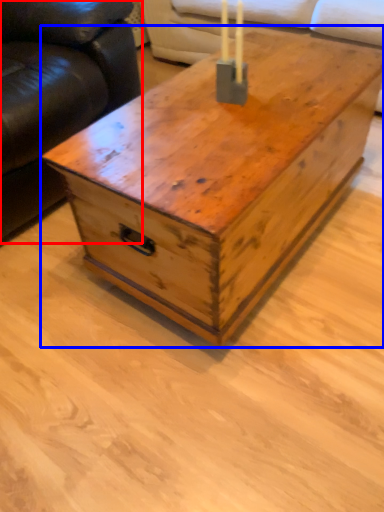
Question: Which object appears farthest to the camera in this image, studio couch (highlighted by a red box) or table (highlighted by a blue box)?

Choices:
 (A) studio couch
 (B) table

Answer: (A)